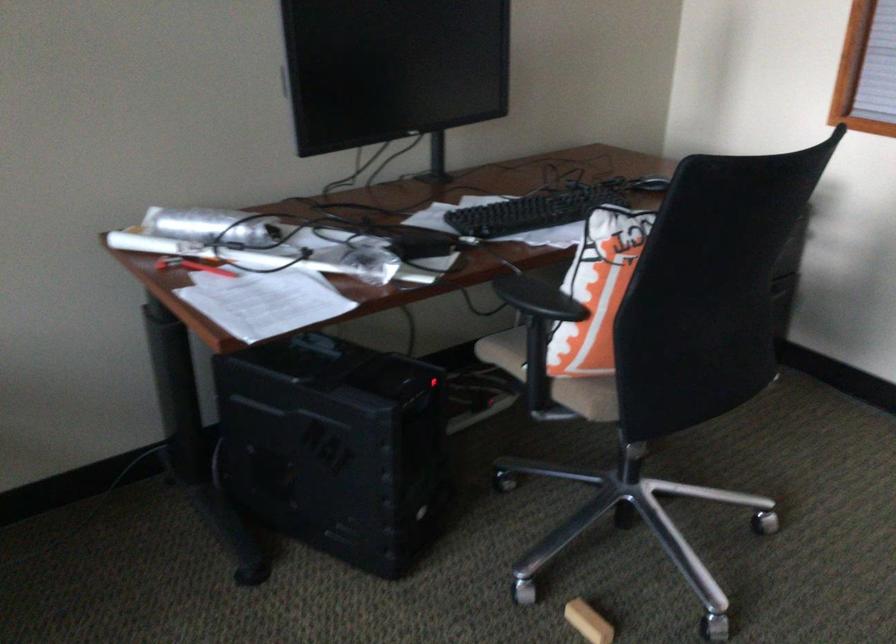
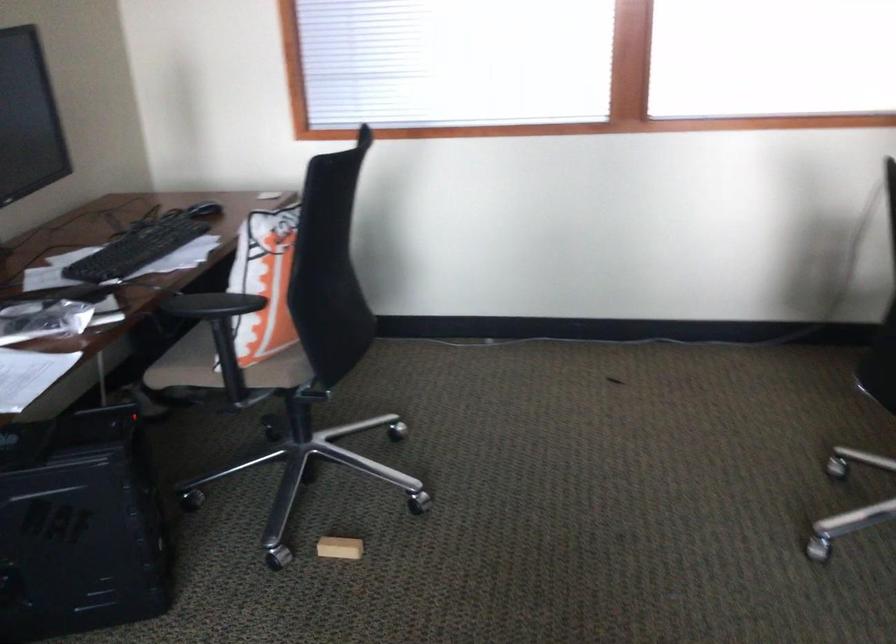
Find the pixel in the second image that matches the point at 519,299 in the first image.

(211, 305)